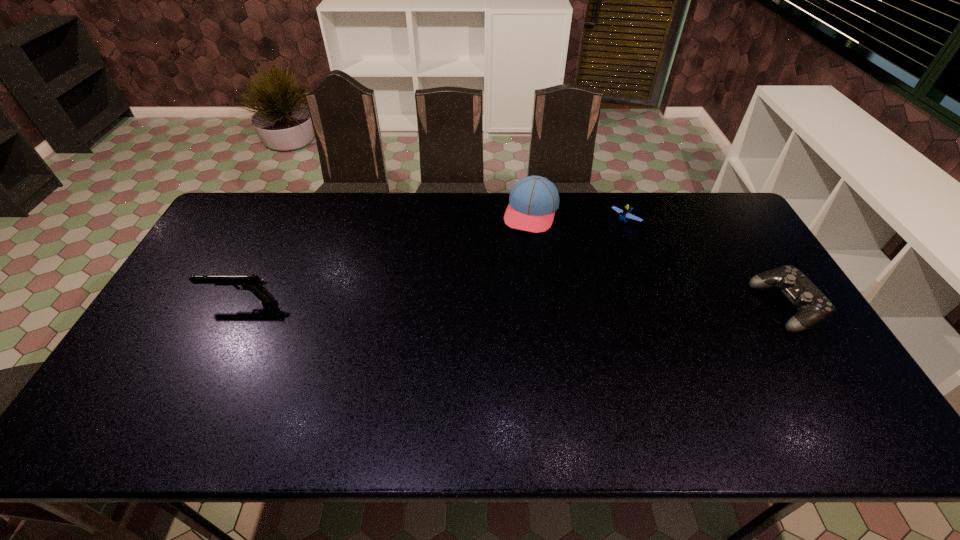
Find the location of a particular element. blank space at the left edge is located at coordinates (167, 357).

In the image, there is a desktop. At what (x,y) coordinates should I click in order to perform the action: click on vacant space at the right edge. Please return your answer as a coordinate pair (x, y). Looking at the image, I should click on (717, 238).

At what (x,y) coordinates should I click in order to perform the action: click on vacant space at the far left corner of the desktop. Please return your answer as a coordinate pair (x, y). This screenshot has width=960, height=540. Looking at the image, I should click on (252, 193).

This screenshot has height=540, width=960. I want to click on free spot between the second shortest object and the shortest object, so click(706, 264).

Identify the location of empty space that is in between the leftmost object and the second object from left to right. (386, 256).

The image size is (960, 540). In order to click on empty space between the shortest object and the baseball cap in this screenshot , I will do click(x=578, y=217).

The height and width of the screenshot is (540, 960). What are the coordinates of `free space between the leftmost object and the third object from right to left` in the screenshot? It's located at (386, 256).

What are the coordinates of `empty space between the control and the shortest object` in the screenshot? It's located at (706, 264).

Image resolution: width=960 pixels, height=540 pixels. In order to click on vacant area that lies between the third object from left to right and the baseball cap in this screenshot , I will do tap(578, 217).

Locate an element on the screen. empty space between the shortest object and the gun is located at coordinates (433, 261).